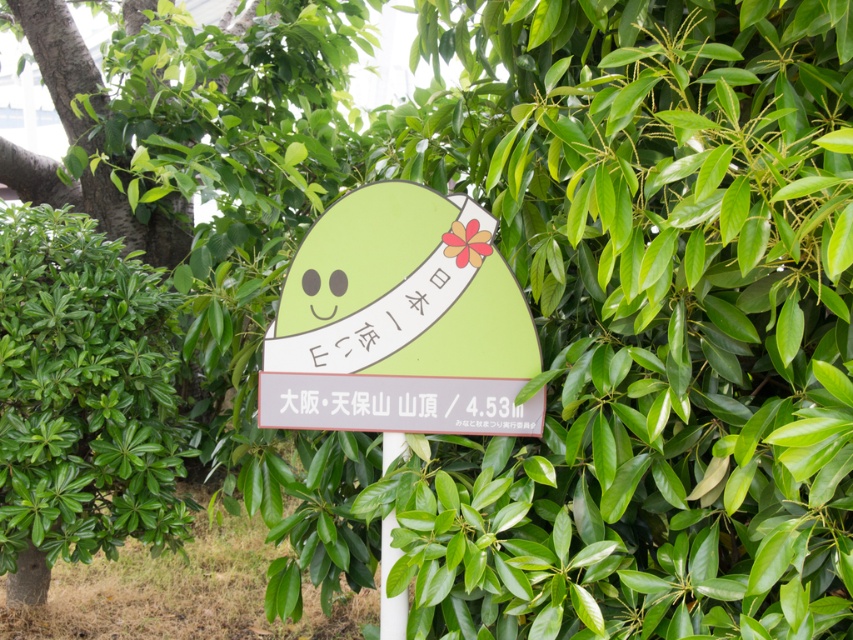
Question: Among these objects, which one is farthest from the camera?

Choices:
 (A) white plastic pole at center
 (B) green leafy hedge at left

Answer: (B)

Question: Is green matte sign at center smaller than white plastic pole at center?

Choices:
 (A) no
 (B) yes

Answer: (A)

Question: Which point appears closest to the camera in this image?

Choices:
 (A) (334, 312)
 (B) (88, 481)

Answer: (A)

Question: Which of the following is the closest to the observer?

Choices:
 (A) (54, 532)
 (B) (456, 248)
 (C) (379, 611)

Answer: (B)

Question: Is green leafy hedge at left further to camera compared to white plastic pole at center?

Choices:
 (A) yes
 (B) no

Answer: (A)

Question: Does green leafy hedge at left have a smaller size compared to green matte sign at center?

Choices:
 (A) yes
 (B) no

Answer: (B)